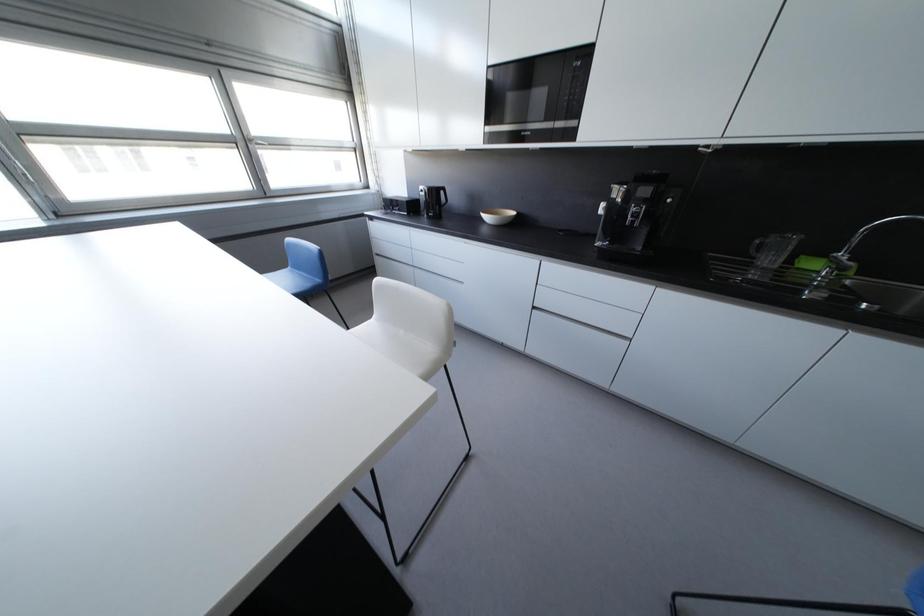
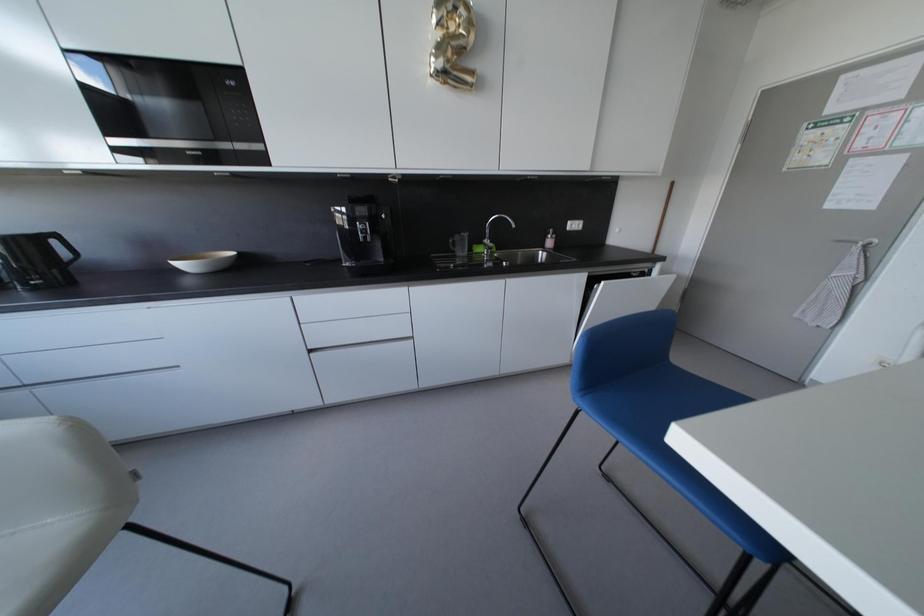
Question: The camera is either moving clockwise (left) or counter-clockwise (right) around the object. The first image is from the beginning of the video and the second image is from the end. Is the camera moving left or right when shooting the video?

Choices:
 (A) Left
 (B) Right

Answer: (A)